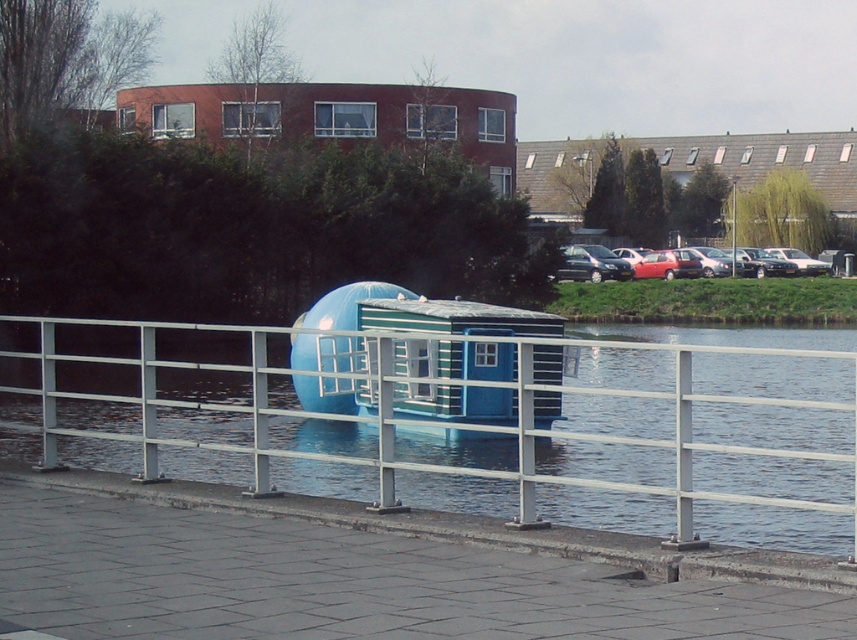
You are a delivery person trying to unload a package onto the gray concrete dock at lower center. However, the metallic silver fence at center might block your path. Can you fit the package through the space between them?

The gray concrete dock at lower center is shorter than the metallic silver fence at center, so the package can fit through the space between them as the dock is lower in height.

You are standing at the point marked as point (370, 573). What object is exactly at this location?

The gray concrete dock at lower center is located at point (370, 573).

You are standing on the walkway near the blue houseboat and want to take a photo that includes both the point at coordinates point (304, 598) and point (579, 492). Which point should you position closer to the front of your camera frame to ensure both are in focus?

You should position the point at coordinates point (304, 598) closer to the front of your camera frame since it is closer to you than point (579, 492). This ensures both points remain in focus as the camera can maintain depth of field for objects at varying distances when the closer object is framed first.